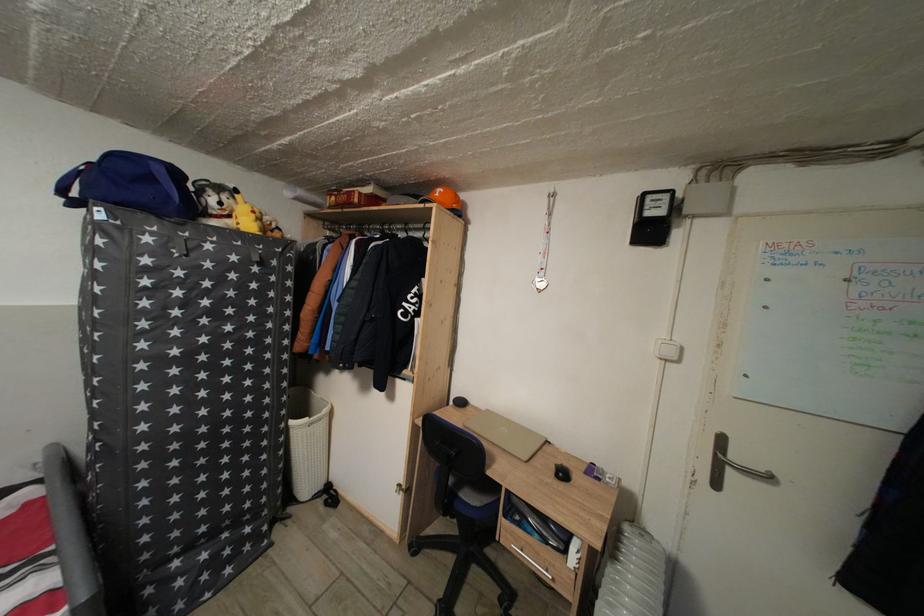
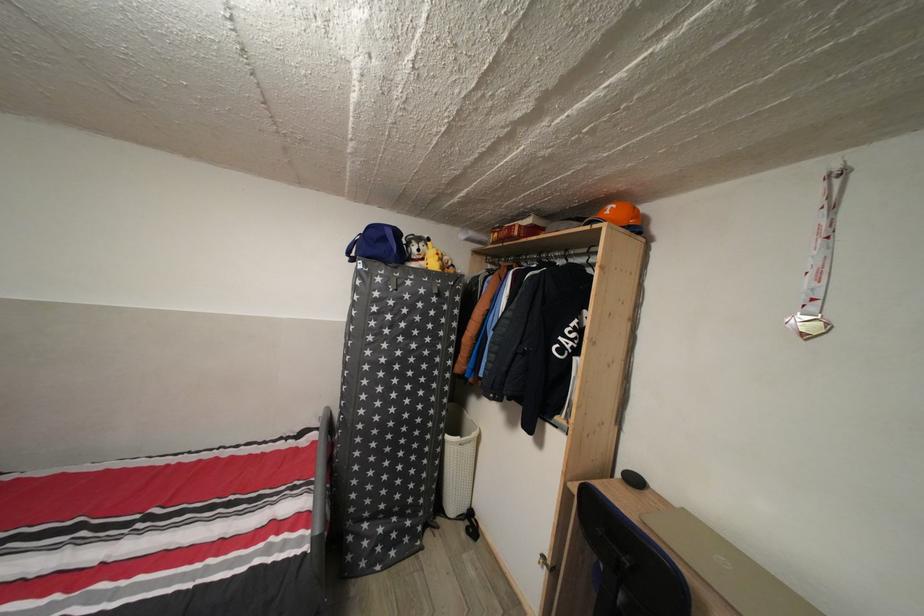
In the second image, find the point that corresponds to [444,201] in the first image.

(614, 219)